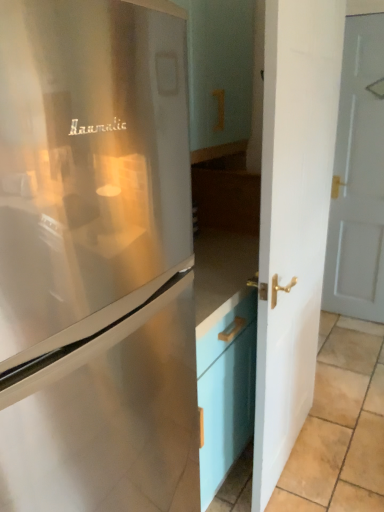
In order to face white glossy door at center, marked as the second door in a right-to-left arrangement, should I rotate leftwards or rightwards?

Rotate right and turn 14.465 degrees.

You are a GUI agent. You are given a task and a screenshot of the screen. Output one action in this format:
    pyautogui.click(x=<x>, y=<y>)
    Task: Click on the beige tile at lower right
    The image size is (384, 512).
    Given the screenshot: What is the action you would take?
    pyautogui.click(x=340, y=426)

I want to click on white glossy door at center, positioned as the second door in back-to-front order, so click(x=293, y=219).

From a real-world perspective, which object stands above the other?

white painted wood door at right, which appears as the 1th door when viewed from the right.

Is point (308, 257) more distant than point (351, 127)?

No, (308, 257) is in front of (351, 127).

The image size is (384, 512). I want to click on door above the white glossy door at center, the 1th door in the front-to-back sequence (from a real-world perspective), so click(x=358, y=178).

Considering the sizes of white glossy door at center, which appears as the first door when viewed from the left, and white painted wood door at right, the second door when ordered from front to back, in the image, is white glossy door at center, which appears as the first door when viewed from the left, taller or shorter than white painted wood door at right, the second door when ordered from front to back,?

Clearly, white glossy door at center, which appears as the first door when viewed from the left, is shorter compared to white painted wood door at right, the second door when ordered from front to back.

Looking at this image, measure the distance between beige tile at lower right and satin silver refrigerator at left.

The distance of beige tile at lower right from satin silver refrigerator at left is 3.72 feet.

In the scene shown: Which point is more distant from viewer, (x=356, y=322) or (x=159, y=0)?

The point (x=356, y=322) is farther.

Can you confirm if beige tile at lower right is wider than satin silver refrigerator at left?

Correct, the width of beige tile at lower right exceeds that of satin silver refrigerator at left.

Is beige tile at lower right aimed at satin silver refrigerator at left?

No.

Which object is thinner, satin silver refrigerator at left or beige tile at lower right?

Thinner between the two is satin silver refrigerator at left.

Considering the positions of objects satin silver refrigerator at left and beige tile at lower right in the image provided, who is more to the left, satin silver refrigerator at left or beige tile at lower right?

satin silver refrigerator at left.

Is satin silver refrigerator at left not near beige tile at lower right?

Yes, satin silver refrigerator at left and beige tile at lower right are quite far apart.

Looking at this image, from a real-world perspective, is satin silver refrigerator at left positioned above or below beige tile at lower right?

satin silver refrigerator at left is situated higher than beige tile at lower right in the real world.

Is white glossy door at center, positioned as the second door in back-to-front order, bigger than satin silver refrigerator at left?

No, white glossy door at center, positioned as the second door in back-to-front order, is not bigger than satin silver refrigerator at left.

From the image's perspective, which is above, white glossy door at center, marked as the second door in a right-to-left arrangement, or satin silver refrigerator at left?

white glossy door at center, marked as the second door in a right-to-left arrangement.

Considering the relative sizes of white glossy door at center, which appears as the first door when viewed from the left, and satin silver refrigerator at left in the image provided, is white glossy door at center, which appears as the first door when viewed from the left, shorter than satin silver refrigerator at left?

No.

Can we say white glossy door at center, positioned as the second door in back-to-front order, lies outside satin silver refrigerator at left?

Yes.

From their relative heights in the image, would you say satin silver refrigerator at left is taller or shorter than white painted wood door at right, the second door when ordered from front to back?

In the image, satin silver refrigerator at left appears to be shorter than white painted wood door at right, the second door when ordered from front to back.

From a real-world perspective, who is located lower, satin silver refrigerator at left or white painted wood door at right, the second door when ordered from front to back?

satin silver refrigerator at left, from a real-world perspective.

From the image's perspective, is satin silver refrigerator at left beneath white painted wood door at right, which appears as the 1th door when viewed from the right?

Correct, satin silver refrigerator at left appears lower than white painted wood door at right, which appears as the 1th door when viewed from the right, in the image.

Are satin silver refrigerator at left and white painted wood door at right, marked as the 1th door in a back-to-front arrangement, located far from each other?

satin silver refrigerator at left is far away from white painted wood door at right, marked as the 1th door in a back-to-front arrangement.

Is the depth of white painted wood door at right, marked as the 1th door in a back-to-front arrangement, less than that of satin silver refrigerator at left?

No, white painted wood door at right, marked as the 1th door in a back-to-front arrangement, is further to the viewer.

Based on the photo, from the image's perspective, relative to satin silver refrigerator at left, is white painted wood door at right, the second door when ordered from front to back, above or below?

white painted wood door at right, the second door when ordered from front to back, is situated higher than satin silver refrigerator at left in the image.

Can you confirm if white painted wood door at right, the second door from the left, is positioned to the left of satin silver refrigerator at left?

Incorrect, white painted wood door at right, the second door from the left, is not on the left side of satin silver refrigerator at left.

What's the angular difference between white painted wood door at right, which appears as the 1th door when viewed from the right, and satin silver refrigerator at left's facing directions?

white painted wood door at right, which appears as the 1th door when viewed from the right, and satin silver refrigerator at left are facing 90 degrees away from each other.

Which is in front, point (369, 179) or point (310, 502)?

The point (310, 502) is closer.

In the scene shown: Is white painted wood door at right, the second door from the left, at the left side of beige tile at lower right?

No, white painted wood door at right, the second door from the left, is not to the left of beige tile at lower right.

Who is shorter, white painted wood door at right, which appears as the 1th door when viewed from the right, or beige tile at lower right?

beige tile at lower right.

Is white painted wood door at right, the second door when ordered from front to back, positioned far away from beige tile at lower right?

Absolutely, white painted wood door at right, the second door when ordered from front to back, is distant from beige tile at lower right.

Locate an element on the screen. This screenshot has width=384, height=512. door that appears above the white glossy door at center, marked as the second door in a right-to-left arrangement (from the image's perspective) is located at coordinates (358, 178).

Identify the location of refrigerator in front of the beige tile at lower right. (96, 258).

Considering their positions, is white glossy door at center, the 1th door in the front-to-back sequence, positioned further to beige tile at lower right than satin silver refrigerator at left?

satin silver refrigerator at left is further to beige tile at lower right.

Based on their spatial positions, is beige tile at lower right or white glossy door at center, marked as the second door in a right-to-left arrangement, closer to white painted wood door at right, which appears as the 1th door when viewed from the right?

The object closer to white painted wood door at right, which appears as the 1th door when viewed from the right, is beige tile at lower right.

Estimate the real-world distances between objects in this image. Which object is closer to satin silver refrigerator at left, white glossy door at center, positioned as the second door in back-to-front order, or beige tile at lower right?

The object closer to satin silver refrigerator at left is white glossy door at center, positioned as the second door in back-to-front order.

When comparing their distances from white glossy door at center, which appears as the first door when viewed from the left, does beige tile at lower right or satin silver refrigerator at left seem further?

beige tile at lower right lies further to white glossy door at center, which appears as the first door when viewed from the left, than the other object.

Which object lies further to the anchor point white glossy door at center, the 1th door in the front-to-back sequence, satin silver refrigerator at left or beige tile at lower right?

The object further to white glossy door at center, the 1th door in the front-to-back sequence, is beige tile at lower right.

Which object lies further to the anchor point beige tile at lower right, satin silver refrigerator at left or white painted wood door at right, which appears as the 1th door when viewed from the right?

satin silver refrigerator at left lies further to beige tile at lower right than the other object.

Considering their positions, is white glossy door at center, positioned as the second door in back-to-front order, positioned closer to white painted wood door at right, the second door from the left, than beige tile at lower right?

beige tile at lower right is positioned closer to the anchor white painted wood door at right, the second door from the left.

Looking at the image, which one is located further to beige tile at lower right, satin silver refrigerator at left or white glossy door at center, positioned as the second door in back-to-front order?

satin silver refrigerator at left.

The width and height of the screenshot is (384, 512). Identify the location of door between satin silver refrigerator at left and white painted wood door at right, the second door when ordered from front to back, in the front-back direction. (293, 219).

Find the location of a particular element. The image size is (384, 512). door located between satin silver refrigerator at left and beige tile at lower right in the depth direction is located at coordinates (293, 219).

Find the location of a particular element. tile between white glossy door at center, the 1th door in the front-to-back sequence, and white painted wood door at right, marked as the 1th door in a back-to-front arrangement, along the z-axis is located at coordinates (340, 426).

Where is `tile between satin silver refrigerator at left and white painted wood door at right, the second door from the left, in the front-back direction`? tile between satin silver refrigerator at left and white painted wood door at right, the second door from the left, in the front-back direction is located at coordinates (340, 426).